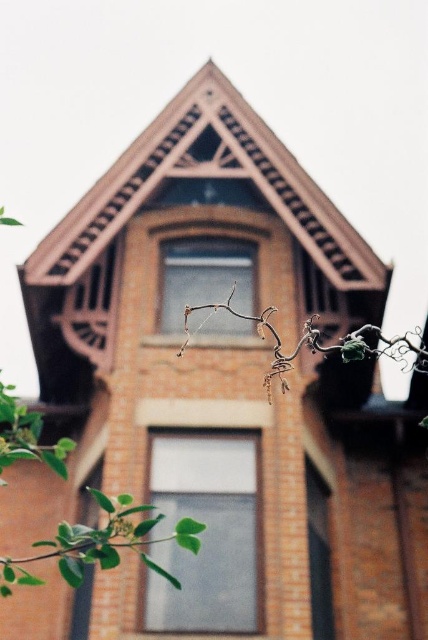
You are an architect designing a new building and want to incorporate elements from this scene. If you need to ensure that the green leafy branch at center and the clear glass window at right are proportionally accurate in your design, which object should you consider measuring first based on their width?

The green leafy branch at center might be wider than the clear glass window at right, so you should measure the green leafy branch at center first to ensure proper proportions.

You are an architect assessing the building facade. You observe the transparent glass window at center and the green leafy branch at center. Which object has a greater width?

The transparent glass window at center has a greater width than the green leafy branch at center.